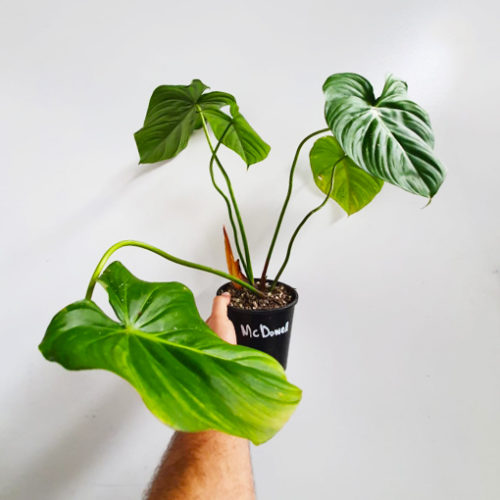
Find the location of `small brown flower pot, center`. small brown flower pot, center is located at coordinates (267, 316).